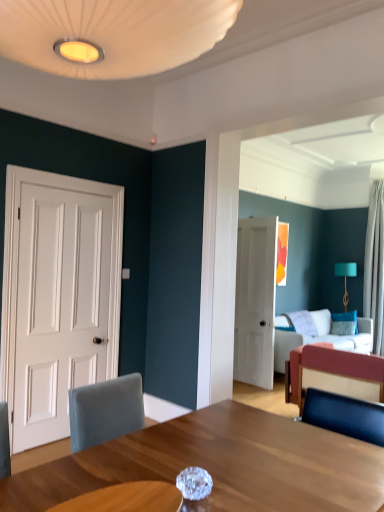
Question: From the image's perspective, does velvet fabric couch at center appear higher than white matte door at left, which ranks as the 1th door in front-to-back order?

Choices:
 (A) yes
 (B) no

Answer: (B)

Question: Can you confirm if velvet fabric couch at center is positioned to the right of white matte door at left, the 1th door viewed from the left?

Choices:
 (A) no
 (B) yes

Answer: (B)

Question: Considering the relative sizes of velvet fabric couch at center and white matte door at left, which is counted as the 2th door, starting from the right, in the image provided, is velvet fabric couch at center wider than white matte door at left, which is counted as the 2th door, starting from the right,?

Choices:
 (A) yes
 (B) no

Answer: (A)

Question: Is velvet fabric couch at center in contact with white matte door at left, the 1th door viewed from the left?

Choices:
 (A) yes
 (B) no

Answer: (B)

Question: Considering the relative sizes of velvet fabric couch at center and white matte door at left, which is counted as the 2th door, starting from the right, in the image provided, is velvet fabric couch at center thinner than white matte door at left, which is counted as the 2th door, starting from the right,?

Choices:
 (A) yes
 (B) no

Answer: (B)

Question: From the image's perspective, is white matte door at center, the second door when ordered from left to right, located above or below white matte door at left, placed as the 2th door when sorted from back to front?

Choices:
 (A) above
 (B) below

Answer: (B)

Question: Looking at the image, does white matte door at center, marked as the first door in a right-to-left arrangement, seem bigger or smaller compared to white matte door at left, placed as the 2th door when sorted from back to front?

Choices:
 (A) big
 (B) small

Answer: (A)

Question: Is point (246, 344) positioned closer to the camera than point (18, 338)?

Choices:
 (A) closer
 (B) farther

Answer: (B)

Question: Which is correct: white matte door at center, the second door positioned from the front, is inside white matte door at left, which ranks as the 1th door in front-to-back order, or outside of it?

Choices:
 (A) outside
 (B) inside

Answer: (A)

Question: Is teal fabric lampshade at upper right taller or shorter than white sheer curtain at right?

Choices:
 (A) short
 (B) tall

Answer: (A)

Question: Is teal fabric lampshade at upper right bigger or smaller than white sheer curtain at right?

Choices:
 (A) big
 (B) small

Answer: (B)

Question: In terms of width, does teal fabric lampshade at upper right look wider or thinner when compared to white sheer curtain at right?

Choices:
 (A) thin
 (B) wide

Answer: (A)

Question: Based on their positions, is teal fabric lampshade at upper right located to the left or right of white sheer curtain at right?

Choices:
 (A) right
 (B) left

Answer: (B)

Question: Visually, is white matte door at left, placed as the 2th door when sorted from back to front, positioned to the left or to the right of velvet red couch at right?

Choices:
 (A) right
 (B) left

Answer: (B)

Question: Relative to velvet red couch at right, is white matte door at left, which is counted as the 2th door, starting from the right, in front or behind?

Choices:
 (A) front
 (B) behind

Answer: (A)